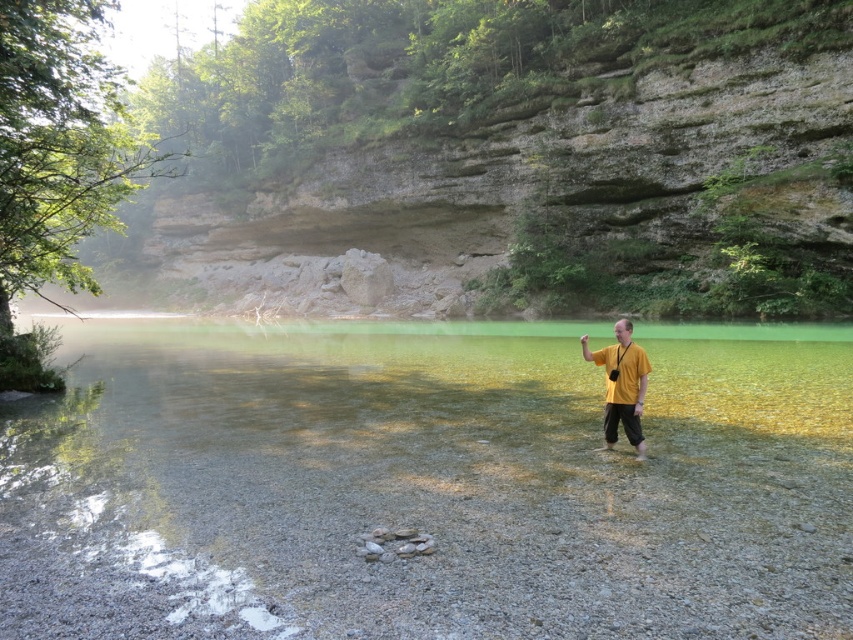
Based on the photo, does clear glass lake at center have a greater height compared to yellow matte shirt at right?

Yes.

Who is positioned more to the left, clear glass lake at center or yellow matte shirt at right?

Positioned to the left is clear glass lake at center.

Where is `clear glass lake at center`? Image resolution: width=853 pixels, height=640 pixels. clear glass lake at center is located at coordinates (427, 483).